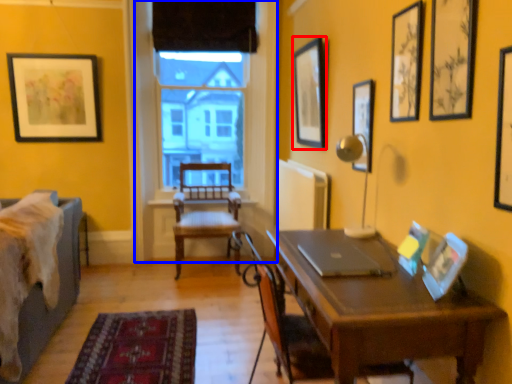
Question: Which point is closer to the camera, picture frame (highlighted by a red box) or window frame (highlighted by a blue box)?

Choices:
 (A) picture frame
 (B) window frame

Answer: (A)